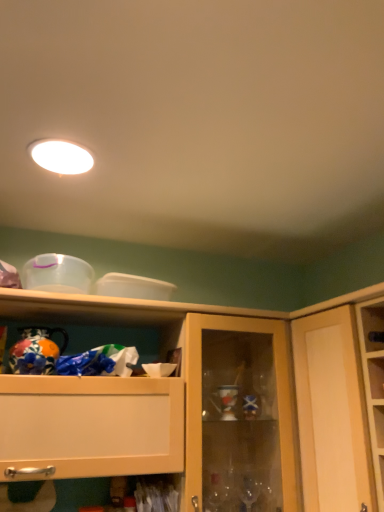
What do you see at coordinates (198, 404) in the screenshot? I see `wooden cabinet at upper center` at bounding box center [198, 404].

What do you see at coordinates (333, 407) in the screenshot? I see `matte wood cupboard at right` at bounding box center [333, 407].

This screenshot has height=512, width=384. What do you see at coordinates (36, 351) in the screenshot? I see `hand-painted ceramic vase at left` at bounding box center [36, 351].

The height and width of the screenshot is (512, 384). Identify the location of wooden cabinet at upper center. (198, 404).

How distant is matte wood cupboard at right from white glossy light fixture at upper center?

A distance of 3.42 feet exists between matte wood cupboard at right and white glossy light fixture at upper center.

Is matte wood cupboard at right spatially inside white glossy light fixture at upper center, or outside of it?

matte wood cupboard at right is spatially situated outside white glossy light fixture at upper center.

Is matte wood cupboard at right smaller than white glossy light fixture at upper center?

No, matte wood cupboard at right is not smaller than white glossy light fixture at upper center.

Between matte wood cupboard at right and white glossy light fixture at upper center, which one is positioned in front?

matte wood cupboard at right is in front.

Is hand-painted ceramic vase at left further to the viewer compared to wooden cabinet at upper center?

Yes, the depth of hand-painted ceramic vase at left is greater than that of wooden cabinet at upper center.

Which of these two, hand-painted ceramic vase at left or wooden cabinet at upper center, is bigger?

wooden cabinet at upper center is bigger.

Is hand-painted ceramic vase at left aimed at wooden cabinet at upper center?

Yes, hand-painted ceramic vase at left is aimed at wooden cabinet at upper center.

From a real-world perspective, who is located higher, hand-painted ceramic vase at left or wooden cabinet at upper center?

In real-world perspective, hand-painted ceramic vase at left is above.

Consider the image. Is wooden cabinet at upper center located outside matte wood cupboard at right?

Indeed, wooden cabinet at upper center is completely outside matte wood cupboard at right.

Considering the relative sizes of wooden cabinet at upper center and matte wood cupboard at right in the image provided, is wooden cabinet at upper center smaller than matte wood cupboard at right?

Actually, wooden cabinet at upper center might be larger than matte wood cupboard at right.

From a real-world perspective, is wooden cabinet at upper center positioned above or below matte wood cupboard at right?

From a real-world perspective, wooden cabinet at upper center is physically below matte wood cupboard at right.

Who is taller, white glossy light fixture at upper center or matte wood cupboard at right?

Standing taller between the two is matte wood cupboard at right.

From the image's perspective, relative to matte wood cupboard at right, is white glossy light fixture at upper center above or below?

white glossy light fixture at upper center is above matte wood cupboard at right.

From a real-world perspective, which is physically above, white glossy light fixture at upper center or matte wood cupboard at right?

white glossy light fixture at upper center.

Where is `cupboard lying on the right of white glossy light fixture at upper center`? This screenshot has width=384, height=512. cupboard lying on the right of white glossy light fixture at upper center is located at coordinates (333, 407).

Could you tell me if white glossy light fixture at upper center is facing hand-painted ceramic vase at left?

No, white glossy light fixture at upper center is not aimed at hand-painted ceramic vase at left.

Considering the sizes of white glossy light fixture at upper center and hand-painted ceramic vase at left in the image, is white glossy light fixture at upper center bigger or smaller than hand-painted ceramic vase at left?

Clearly, white glossy light fixture at upper center is smaller in size than hand-painted ceramic vase at left.

Can hand-painted ceramic vase at left be found inside white glossy light fixture at upper center?

That's incorrect, hand-painted ceramic vase at left is not inside white glossy light fixture at upper center.

Which is behind, white glossy light fixture at upper center or hand-painted ceramic vase at left?

hand-painted ceramic vase at left is behind.

Could you tell me if wooden cabinet at upper center is facing white glossy light fixture at upper center?

No, wooden cabinet at upper center is not turned towards white glossy light fixture at upper center.

Which object is positioned more to the left, wooden cabinet at upper center or white glossy light fixture at upper center?

white glossy light fixture at upper center is more to the left.

Is wooden cabinet at upper center in front of white glossy light fixture at upper center?

Yes, it is in front of white glossy light fixture at upper center.

From the image's perspective, which is below, wooden cabinet at upper center or white glossy light fixture at upper center?

From the image's view, wooden cabinet at upper center is below.

Can you confirm if white glossy light fixture at upper center is positioned to the left of wooden cabinet at upper center?

Yes, white glossy light fixture at upper center is to the left of wooden cabinet at upper center.

Do you think white glossy light fixture at upper center is within wooden cabinet at upper center, or outside of it?

white glossy light fixture at upper center is located beyond the bounds of wooden cabinet at upper center.

Does white glossy light fixture at upper center have a greater height compared to wooden cabinet at upper center?

No, white glossy light fixture at upper center is not taller than wooden cabinet at upper center.

Identify the location of lighting on the left side of matte wood cupboard at right. (61, 156).

What are the coordinates of `toy behind the wooden cabinet at upper center` in the screenshot? It's located at (36, 351).

Based on their spatial positions, is white glossy light fixture at upper center or hand-painted ceramic vase at left closer to matte wood cupboard at right?

hand-painted ceramic vase at left lies closer to matte wood cupboard at right than the other object.

Estimate the real-world distances between objects in this image. Which object is further from matte wood cupboard at right, white glossy light fixture at upper center or wooden cabinet at upper center?

white glossy light fixture at upper center.

Estimate the real-world distances between objects in this image. Which object is further from wooden cabinet at upper center, matte wood cupboard at right or hand-painted ceramic vase at left?

hand-painted ceramic vase at left is further to wooden cabinet at upper center.

From the image, which object appears to be nearer to hand-painted ceramic vase at left, matte wood cupboard at right or wooden cabinet at upper center?

The object closer to hand-painted ceramic vase at left is wooden cabinet at upper center.

In the scene shown: Estimate the real-world distances between objects in this image. Which object is further from white glossy light fixture at upper center, wooden cabinet at upper center or hand-painted ceramic vase at left?

Based on the image, wooden cabinet at upper center appears to be further to white glossy light fixture at upper center.

Looking at the image, which one is located closer to wooden cabinet at upper center, white glossy light fixture at upper center or matte wood cupboard at right?

Based on the image, matte wood cupboard at right appears to be nearer to wooden cabinet at upper center.

Looking at the image, which one is located closer to matte wood cupboard at right, hand-painted ceramic vase at left or wooden cabinet at upper center?

wooden cabinet at upper center is positioned closer to the anchor matte wood cupboard at right.

Based on their spatial positions, is matte wood cupboard at right or hand-painted ceramic vase at left closer to white glossy light fixture at upper center?

hand-painted ceramic vase at left is closer to white glossy light fixture at upper center.

This screenshot has height=512, width=384. Find the location of `cabinetry situated between hand-painted ceramic vase at left and matte wood cupboard at right from left to right`. cabinetry situated between hand-painted ceramic vase at left and matte wood cupboard at right from left to right is located at coordinates (198, 404).

This screenshot has width=384, height=512. Find the location of `lighting between hand-painted ceramic vase at left and matte wood cupboard at right from left to right`. lighting between hand-painted ceramic vase at left and matte wood cupboard at right from left to right is located at coordinates (61, 156).

Where is `toy between white glossy light fixture at upper center and wooden cabinet at upper center in the up-down direction`? The width and height of the screenshot is (384, 512). toy between white glossy light fixture at upper center and wooden cabinet at upper center in the up-down direction is located at coordinates (36, 351).

Identify the location of cabinetry located between white glossy light fixture at upper center and matte wood cupboard at right in the left-right direction. This screenshot has height=512, width=384. (198, 404).